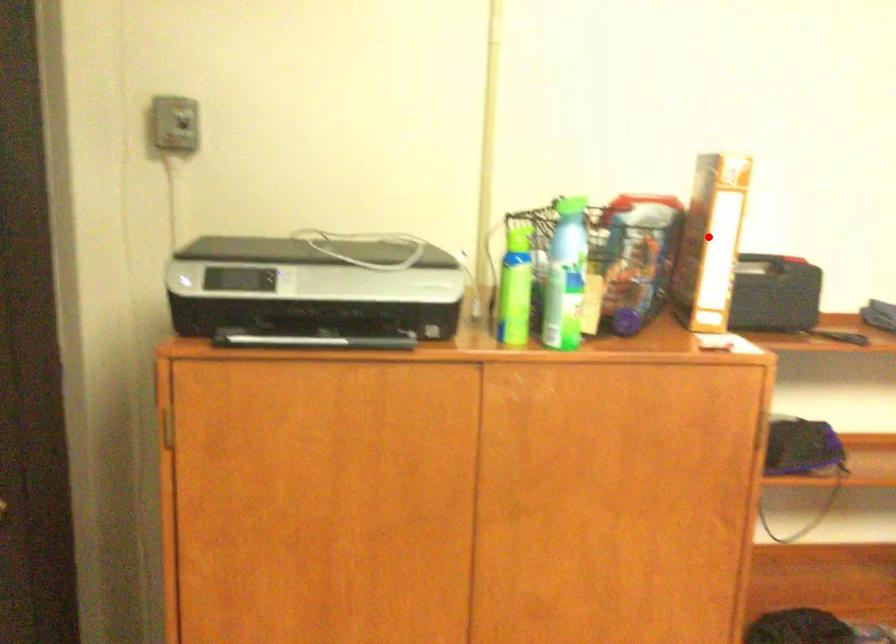
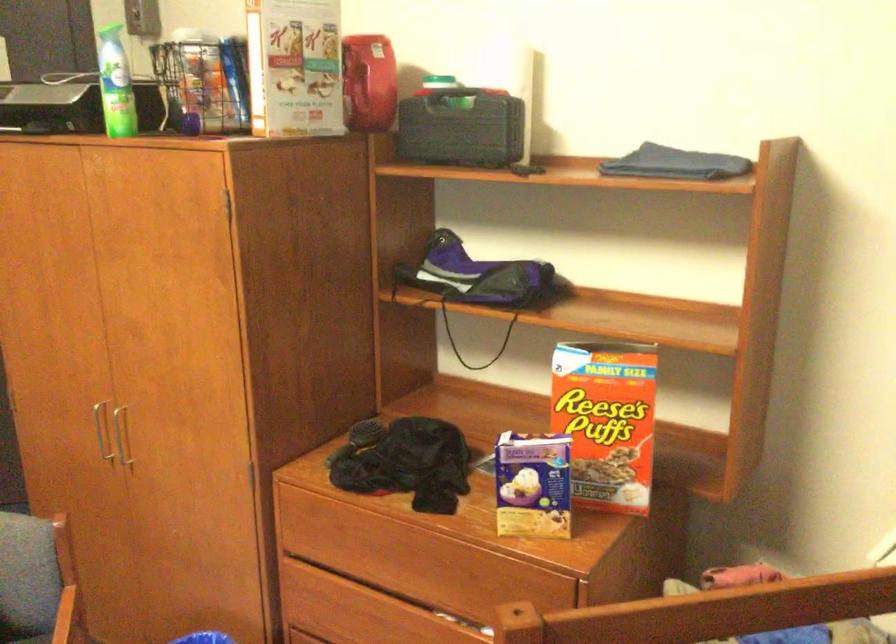
Question: I am providing you with two images of the same scene from different viewpoints. In image1, a red point is highlighted. Considering the same 3D point in image2, which of the following is correct?

Choices:
 (A) It is closer
 (B) It is farther

Answer: (B)